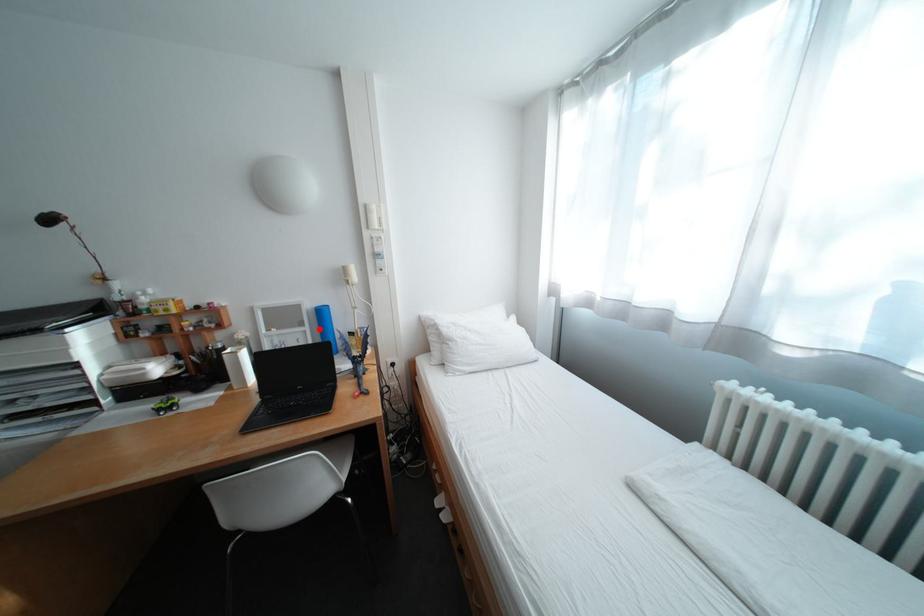
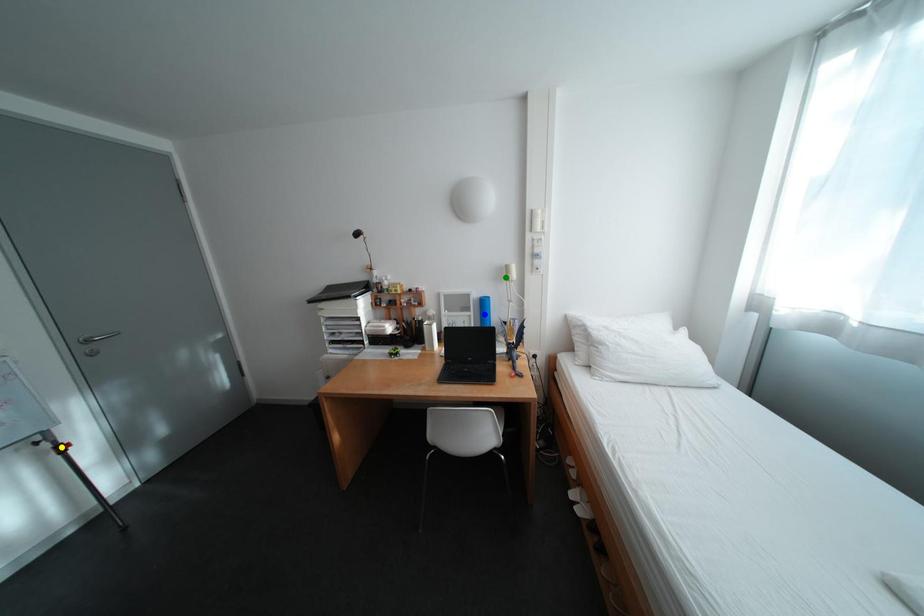
Question: I am providing you with two images of the same scene from different viewpoints. A red point is marked on the first image. You are given multiple points on the second image. Which point in image 2 represents the same 3d spot as the red point in image 1?

Choices:
 (A) yellow point
 (B) green point
 (C) blue point

Answer: (C)